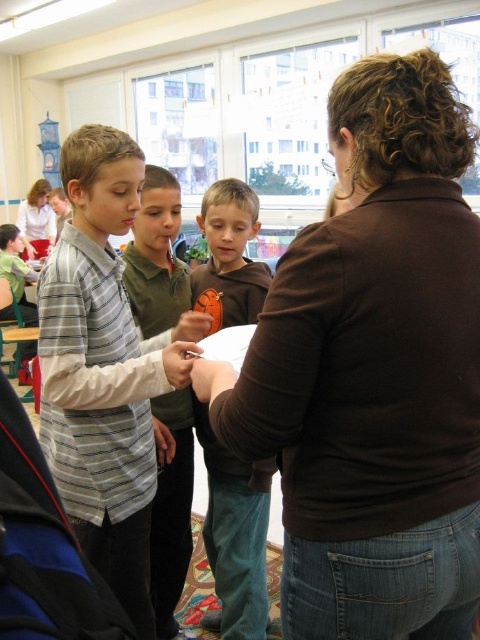
Does striped fabric shirt at left lie in front of matte plastic spoon at center?

Yes.

Which of these two, striped fabric shirt at left or matte plastic spoon at center, stands taller?

With more height is striped fabric shirt at left.

Who is more distant from viewer, (x=143, y=344) or (x=192, y=326)?

The point (x=143, y=344) is behind.

At what (x,y) coordinates should I click in order to perform the action: click on striped fabric shirt at left. Please return your answer as a coordinate pair (x, y). The height and width of the screenshot is (640, 480). Looking at the image, I should click on (101, 371).

Between green matte shirt at center and matte skin hand at center, which one has less height?

matte skin hand at center

Does green matte shirt at center lie in front of matte skin hand at center?

No, it is not.

The image size is (480, 640). What do you see at coordinates (171, 512) in the screenshot?
I see `green matte shirt at center` at bounding box center [171, 512].

This screenshot has width=480, height=640. I want to click on green matte shirt at center, so click(171, 512).

Is point (414, 173) closer to camera compared to point (148, 534)?

Yes, it is.

Is the position of brown matte shirt at center more distant than that of striped fabric shirt at left?

No, brown matte shirt at center is closer to the viewer.

You are a GUI agent. You are given a task and a screenshot of the screen. Output one action in this format:
    pyautogui.click(x=<x>, y=<y>)
    Task: Click on the brown matte shirt at center
    This screenshot has width=480, height=640.
    Given the screenshot: What is the action you would take?
    pyautogui.click(x=373, y=371)